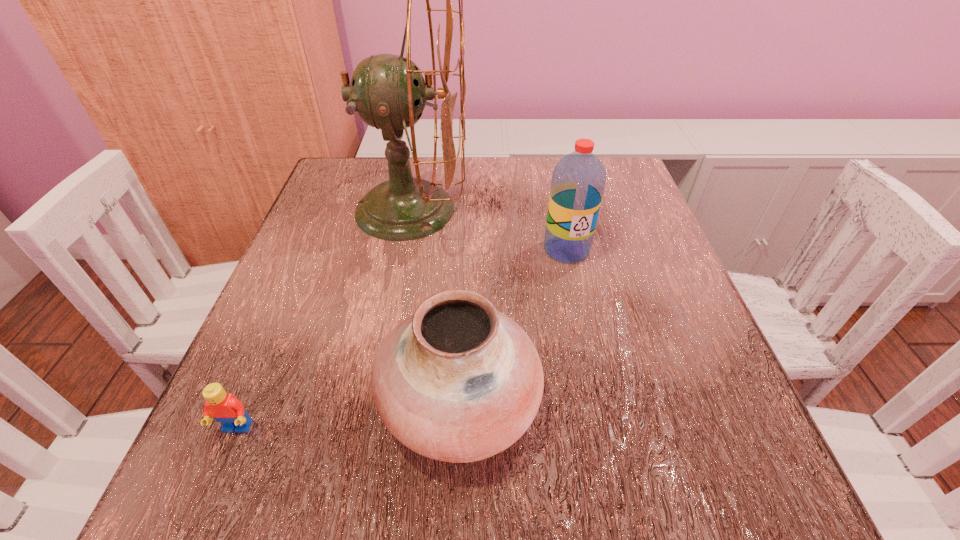
The width and height of the screenshot is (960, 540). Identify the location of free spot that satisfies the following two spatial constraints: 1. in front of the fan, directing air flow; 2. on the back side of the pottery. (374, 401).

Find the location of a particular element. Image resolution: width=960 pixels, height=540 pixels. free spot that satisfies the following two spatial constraints: 1. in front of the tallest object, directing air flow; 2. on the left side of the pottery is located at coordinates (374, 401).

At what (x,y) coordinates should I click in order to perform the action: click on vacant region that satisfies the following two spatial constraints: 1. in front of the fan, directing air flow; 2. on the back side of the pottery. Please return your answer as a coordinate pair (x, y). Image resolution: width=960 pixels, height=540 pixels. Looking at the image, I should click on (374, 401).

The height and width of the screenshot is (540, 960). I want to click on free point that satisfies the following two spatial constraints: 1. on the back side of the pottery; 2. in front of the fan, directing air flow, so click(x=467, y=210).

The width and height of the screenshot is (960, 540). I want to click on vacant area that satisfies the following two spatial constraints: 1. in front of the fan, directing air flow; 2. on the face of the Lego, so click(369, 429).

Locate an element on the screen. The height and width of the screenshot is (540, 960). blank space that satisfies the following two spatial constraints: 1. in front of the tallest object, directing air flow; 2. on the face of the shortest object is located at coordinates (369, 429).